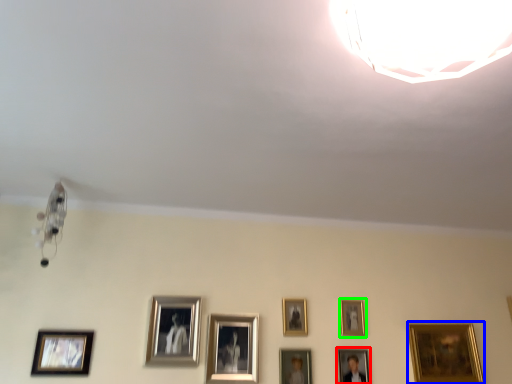
Question: Based on their relative distances, which object is farther from picture frame (highlighted by a red box)? Choose from picture frame (highlighted by a blue box) and picture frame (highlighted by a green box).

Choices:
 (A) picture frame
 (B) picture frame

Answer: (A)